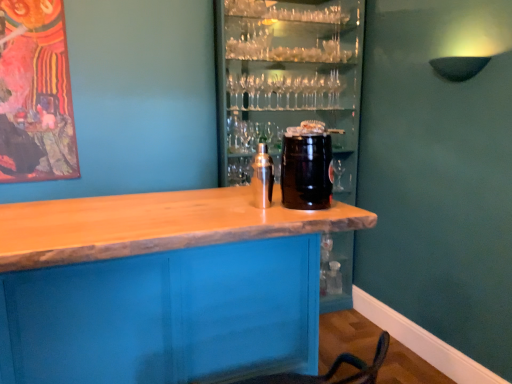
The height and width of the screenshot is (384, 512). Find the location of `vacant area situated to the left side of black matte keg at center, the first beverage from the right`. vacant area situated to the left side of black matte keg at center, the first beverage from the right is located at coordinates pos(248,206).